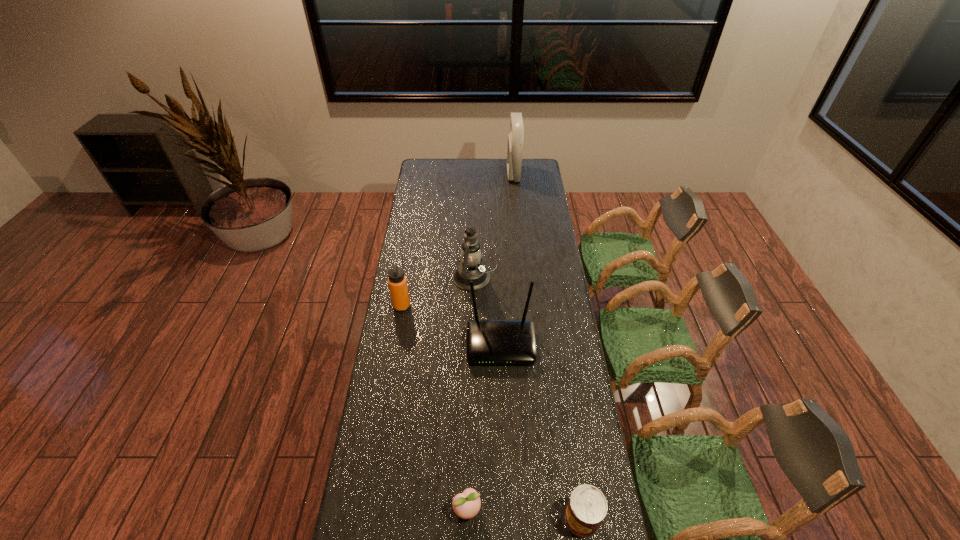
This screenshot has width=960, height=540. I want to click on the first-aid kit, so click(515, 139).

Find the location of `oil lamp`. oil lamp is located at coordinates (471, 268).

Locate an element on the screen. The height and width of the screenshot is (540, 960). the fourth farthest object is located at coordinates (489, 342).

You are a GUI agent. You are given a task and a screenshot of the screen. Output one action in this format:
    pyautogui.click(x=<x>, y=<y>)
    Task: Click on the third farthest object
    
    Given the screenshot: What is the action you would take?
    pyautogui.click(x=397, y=282)

Locate an element on the screen. thermos bottle is located at coordinates (397, 282).

Locate an element on the screen. The width and height of the screenshot is (960, 540). the rightmost object is located at coordinates (587, 507).

Identify the location of can. (587, 507).

At what (x,y) coordinates should I click in order to perform the action: click on peach. Please return your answer as a coordinate pair (x, y). This screenshot has width=960, height=540. Looking at the image, I should click on (466, 505).

Where is `vacant position located on the front-facing side of the first-aid kit`? This screenshot has height=540, width=960. vacant position located on the front-facing side of the first-aid kit is located at coordinates (491, 174).

Find the location of `blank space located on the front-facing side of the first-aid kit`. blank space located on the front-facing side of the first-aid kit is located at coordinates (497, 174).